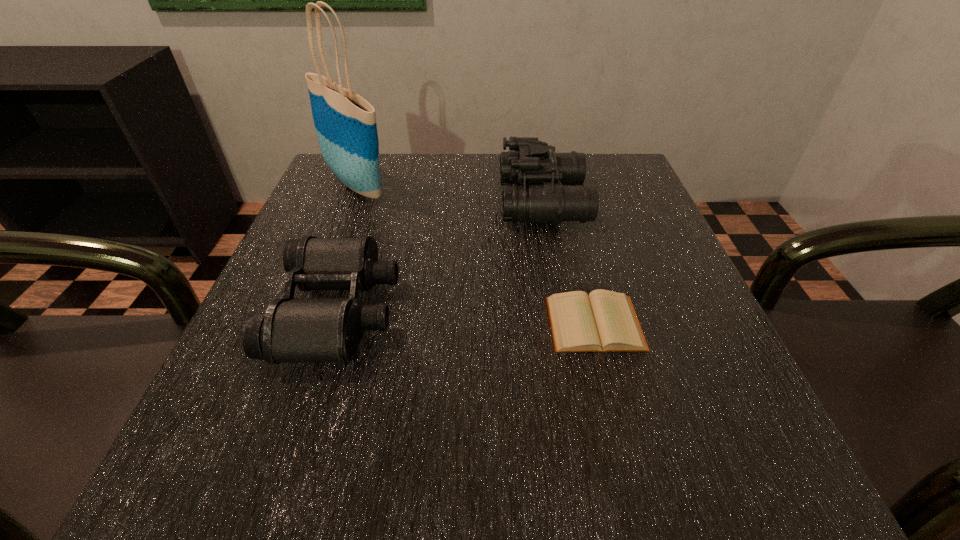
Find the location of a particular element. This screenshot has width=960, height=540. tote bag is located at coordinates (345, 123).

I want to click on the third shortest object, so click(x=542, y=199).

The image size is (960, 540). In order to click on the right binoculars in this screenshot , I will do `click(542, 199)`.

Image resolution: width=960 pixels, height=540 pixels. I want to click on the shorter binoculars, so click(293, 329).

The width and height of the screenshot is (960, 540). I want to click on the nearer binoculars, so click(x=293, y=329).

The width and height of the screenshot is (960, 540). Identify the location of the shortest object. (604, 321).

What are the coordinates of `free space located 0.210m on the right of the tallest object` in the screenshot? It's located at (489, 184).

You are a GUI agent. You are given a task and a screenshot of the screen. Output one action in this format:
    pyautogui.click(x=<x>, y=<y>)
    Task: Click on the free space located 0.050m through the lenses of the second tallest object
    This screenshot has height=540, width=960.
    Given the screenshot: What is the action you would take?
    pyautogui.click(x=478, y=201)

In order to click on free location located through the lenses of the second tallest object in this screenshot , I will do (x=468, y=201).

Identify the location of vacant area located through the lenses of the second tallest object. (390, 201).